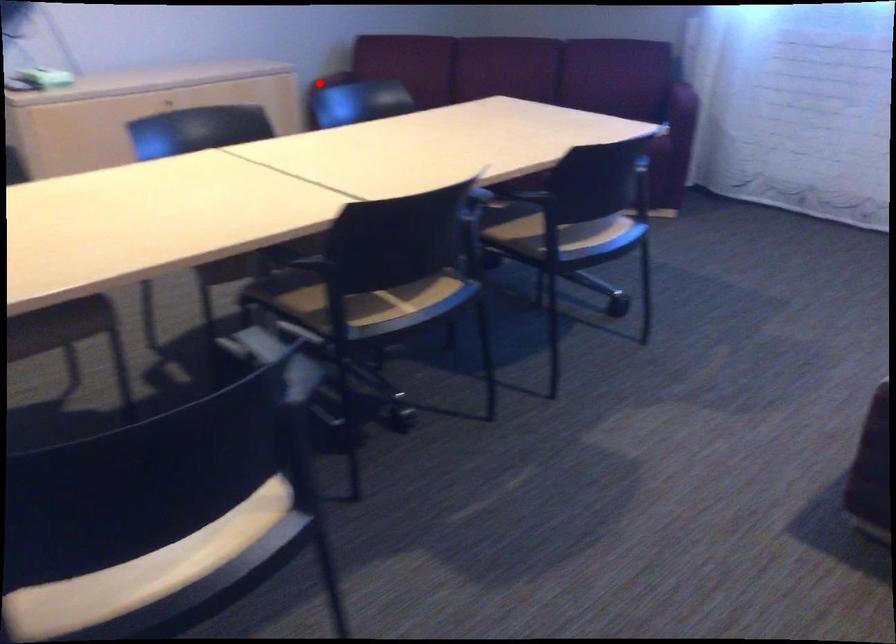
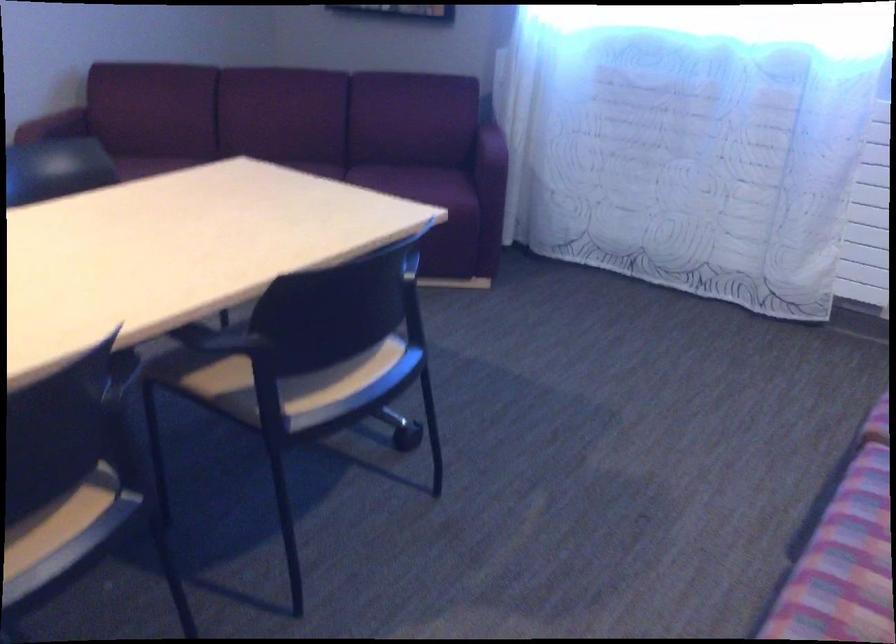
Locate, in the second image, the point that corresponds to the highlighted location in the first image.

(54, 125)